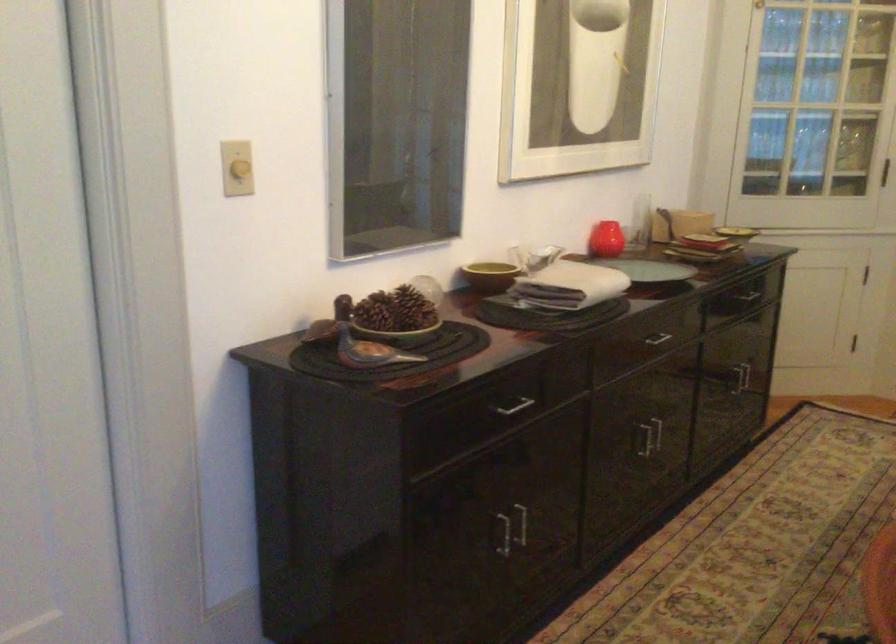
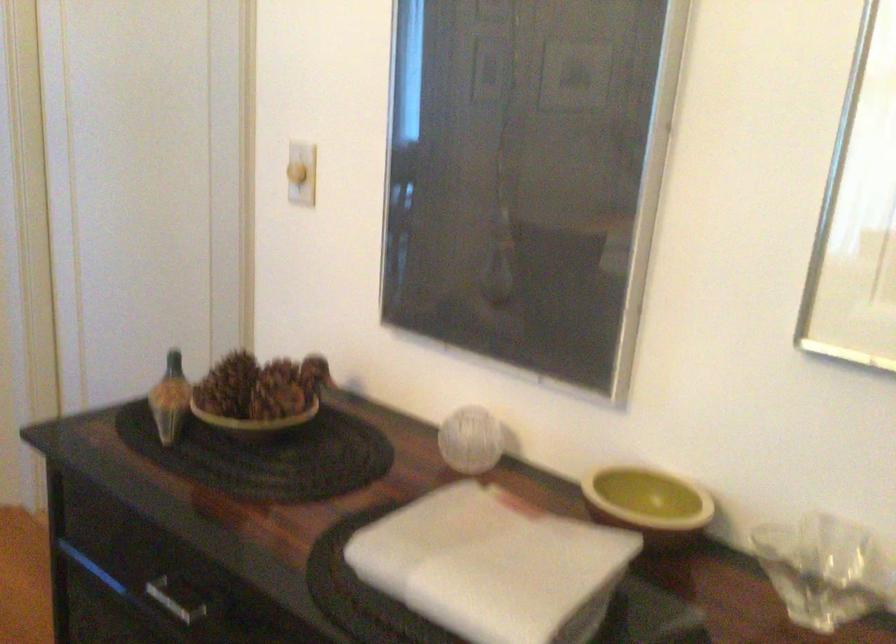
In the second image, find the point that corresponds to [247,153] in the first image.

(297, 173)